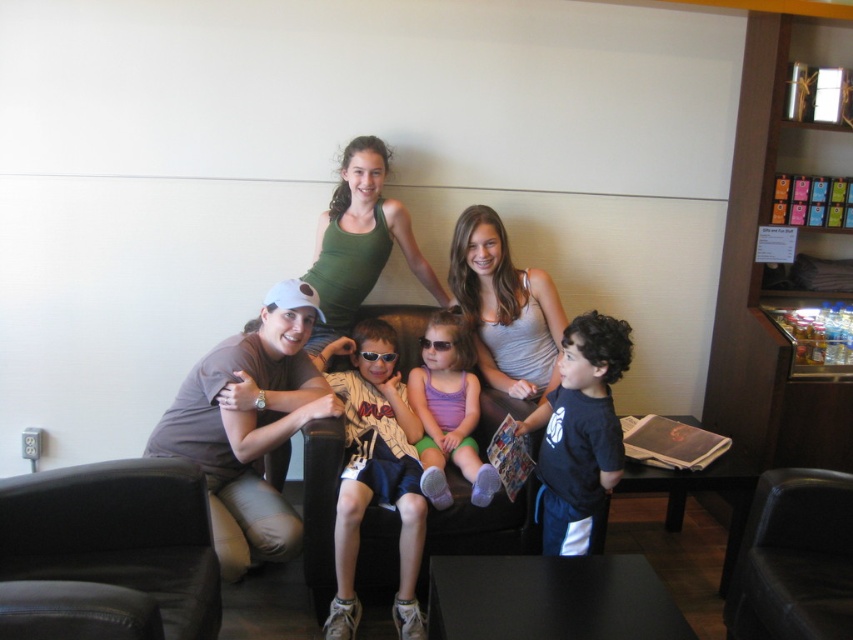
Is matte green tank top at upper center closer to the viewer compared to sunglasses at center?

That is True.

Between point (234, 378) and point (381, 355), which one is positioned behind?

Positioned behind is point (381, 355).

What do you see at coordinates (300, 328) in the screenshot?
I see `matte green tank top at upper center` at bounding box center [300, 328].

Find the location of a particular element. Image resolution: width=853 pixels, height=640 pixels. matte green tank top at upper center is located at coordinates (300, 328).

Is brown cotton t-shirt at lower left positioned at the back of purple fabric dress at center?

No, it is not.

Which of these two, brown cotton t-shirt at lower left or purple fabric dress at center, stands taller?

With more height is brown cotton t-shirt at lower left.

Is point (274, 417) farther from viewer compared to point (421, 403)?

No.

Where is `brown cotton t-shirt at lower left`? This screenshot has width=853, height=640. brown cotton t-shirt at lower left is located at coordinates (248, 426).

Is brown cotton t-shirt at lower left shorter than brown leather couch at center?

Yes, brown cotton t-shirt at lower left is shorter than brown leather couch at center.

Is brown cotton t-shirt at lower left positioned before brown leather couch at center?

That is True.

Where is `brown cotton t-shirt at lower left`? brown cotton t-shirt at lower left is located at coordinates (248, 426).